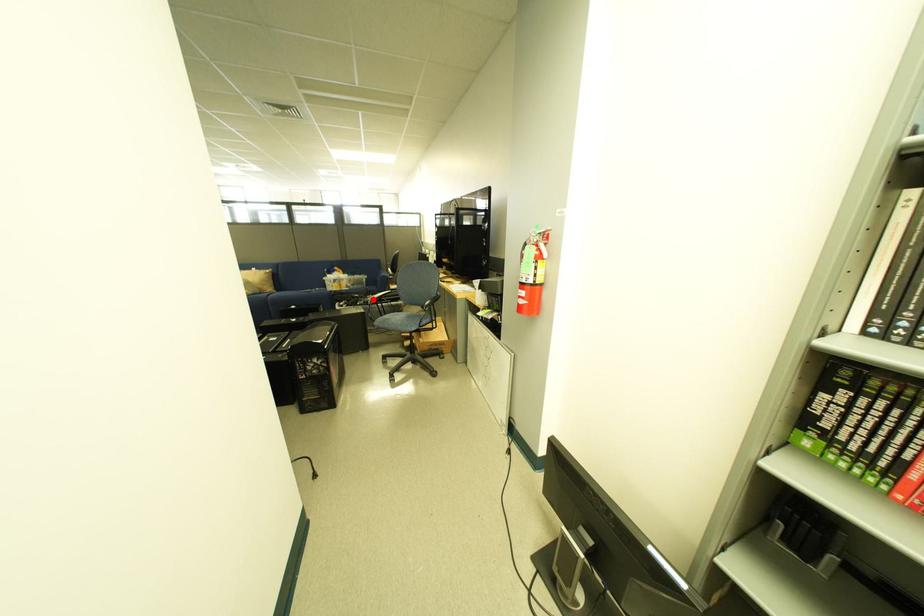
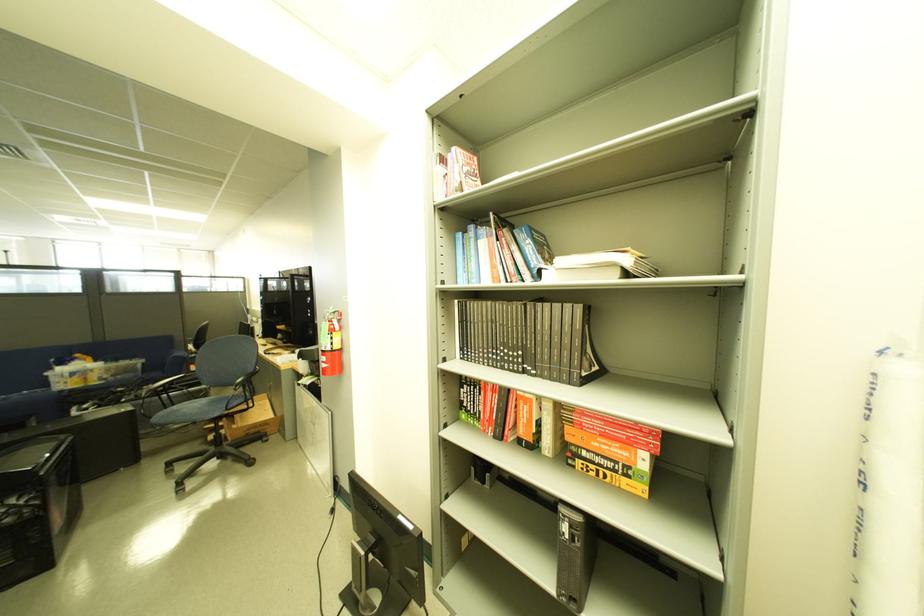
In the second image, find the point that corresponds to the highlighted location in the first image.

(142, 392)